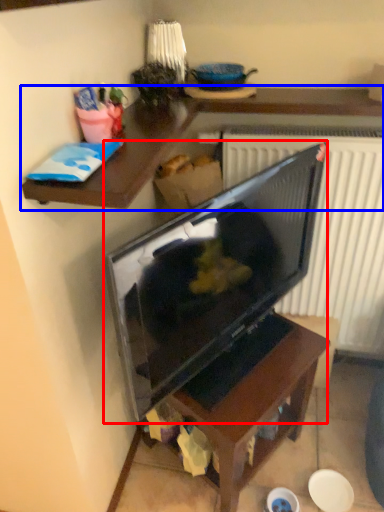
Question: Which object appears farthest to the camera in this image, television (highlighted by a red box) or desk (highlighted by a blue box)?

Choices:
 (A) television
 (B) desk

Answer: (B)